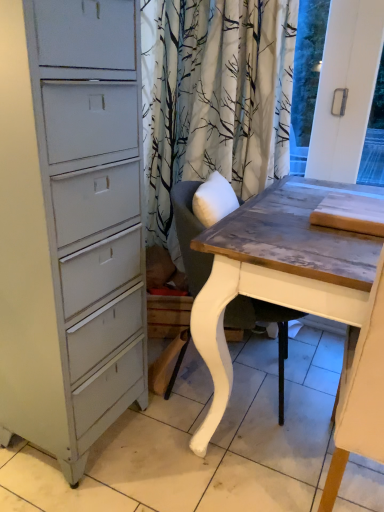
What are the coordinates of `free space that is to the left of wooden table at right` in the screenshot? It's located at click(219, 469).